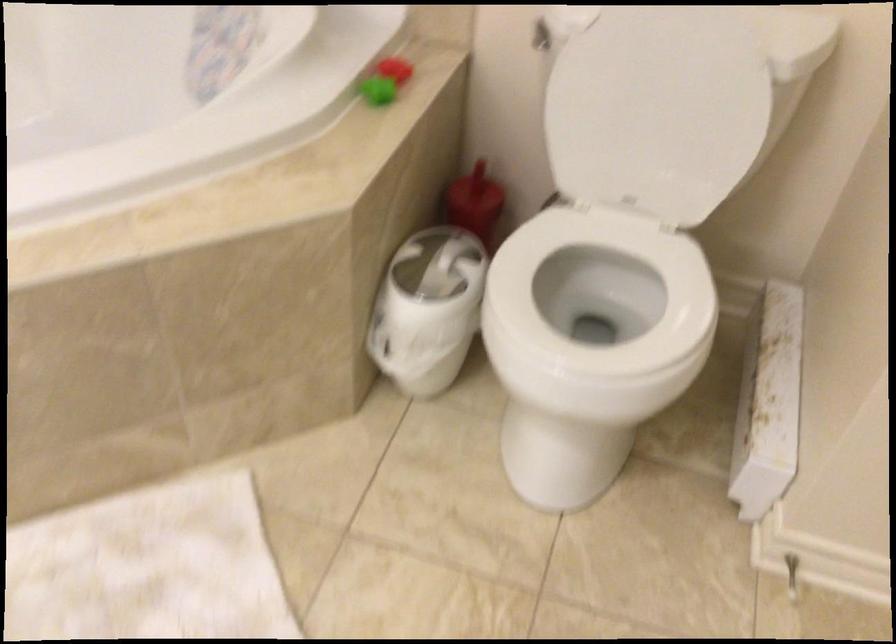
Where would you lift the small green object? Please return your answer as a coordinate pair (x, y).

(377, 90)